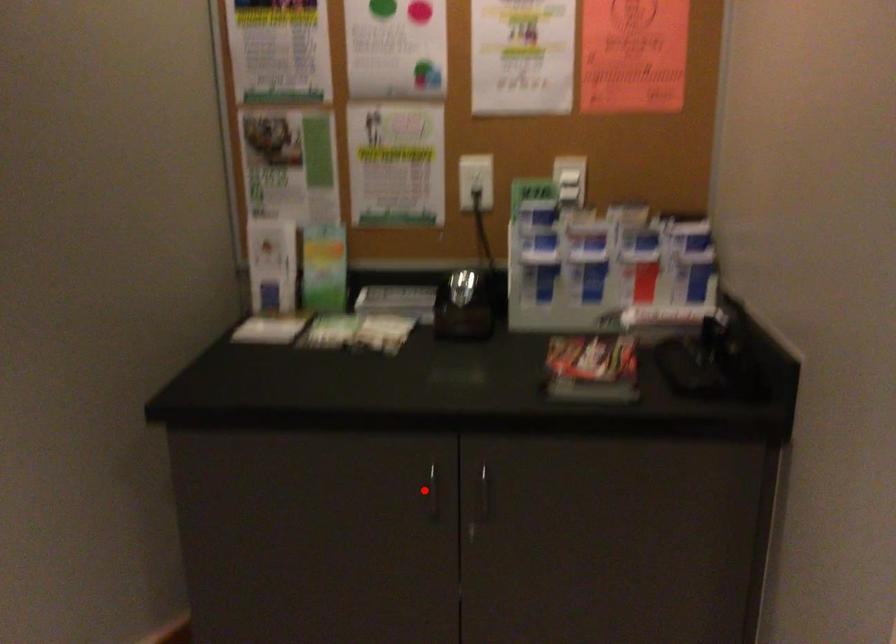
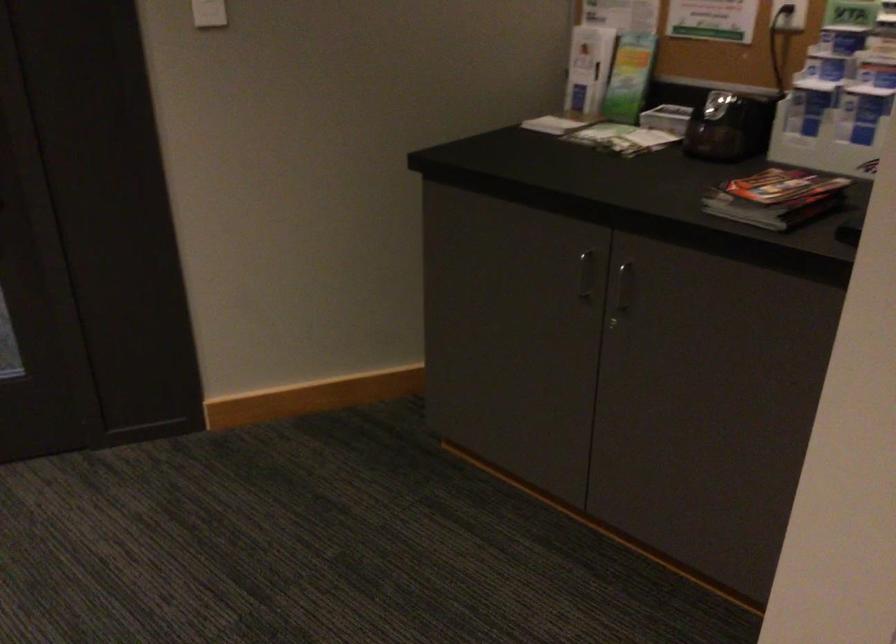
Question: I am providing you with two images of the same scene from different viewpoints. In image1, a red point is highlighted. Considering the same 3D point in image2, which of the following is correct?

Choices:
 (A) It is closer
 (B) It is farther

Answer: (B)